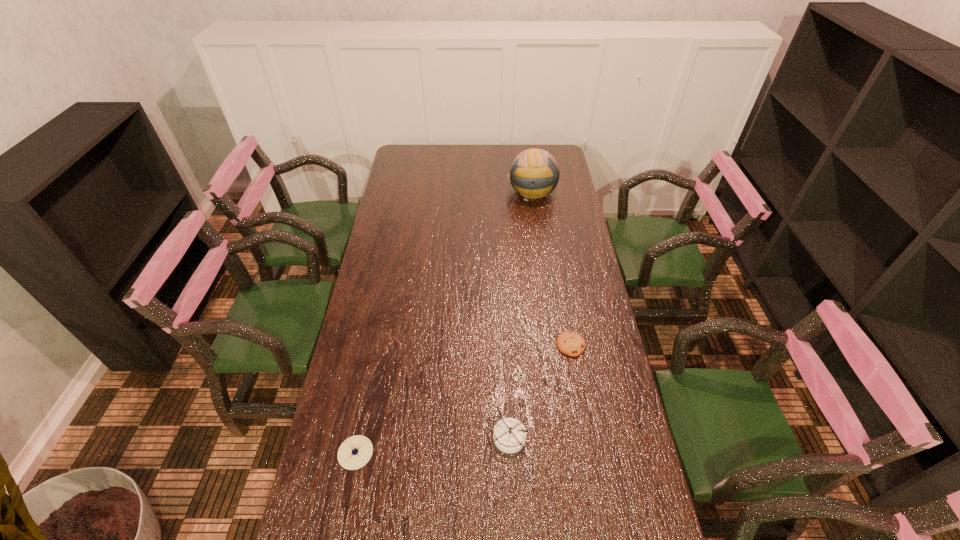
Select which object is the closest to the right compass. Please provide its 2D coordinates. Your answer should be formatted as a tuple, i.e. [(x, y)], where the tuple contains the x and y coordinates of a point satisfying the conditions above.

[(570, 343)]